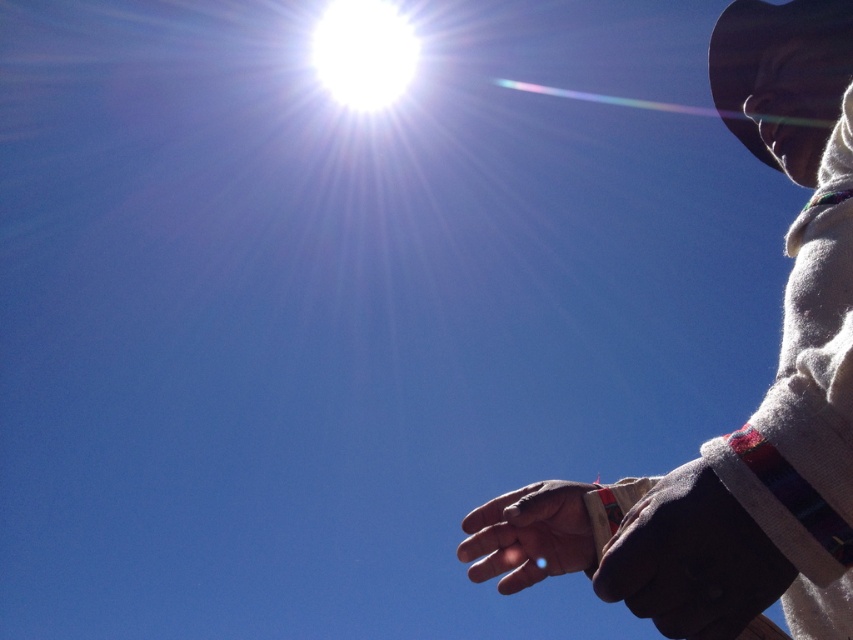
Measure the distance between point (793, 20) and camera.

A distance of 6.18 feet exists between point (793, 20) and camera.

Does white woolen sweater at right have a lesser width compared to leather wristwatch at lower right?

No, white woolen sweater at right is not thinner than leather wristwatch at lower right.

Where is `white woolen sweater at right`? The width and height of the screenshot is (853, 640). white woolen sweater at right is located at coordinates (758, 406).

Which is above, leather wristwatch at lower right or brown leather hand at lower right?

Positioned higher is leather wristwatch at lower right.

Between leather wristwatch at lower right and brown leather hand at lower right, which one is positioned lower?

Positioned lower is brown leather hand at lower right.

Is point (744, 515) closer to viewer compared to point (561, 548)?

That is True.

I want to click on leather wristwatch at lower right, so click(x=691, y=560).

The height and width of the screenshot is (640, 853). What do you see at coordinates (758, 406) in the screenshot?
I see `white woolen sweater at right` at bounding box center [758, 406].

Can you confirm if white woolen sweater at right is thinner than brown leather hand at lower right?

No, white woolen sweater at right is not thinner than brown leather hand at lower right.

The width and height of the screenshot is (853, 640). Describe the element at coordinates (758, 406) in the screenshot. I see `white woolen sweater at right` at that location.

Where is `white woolen sweater at right`? This screenshot has height=640, width=853. white woolen sweater at right is located at coordinates (758, 406).